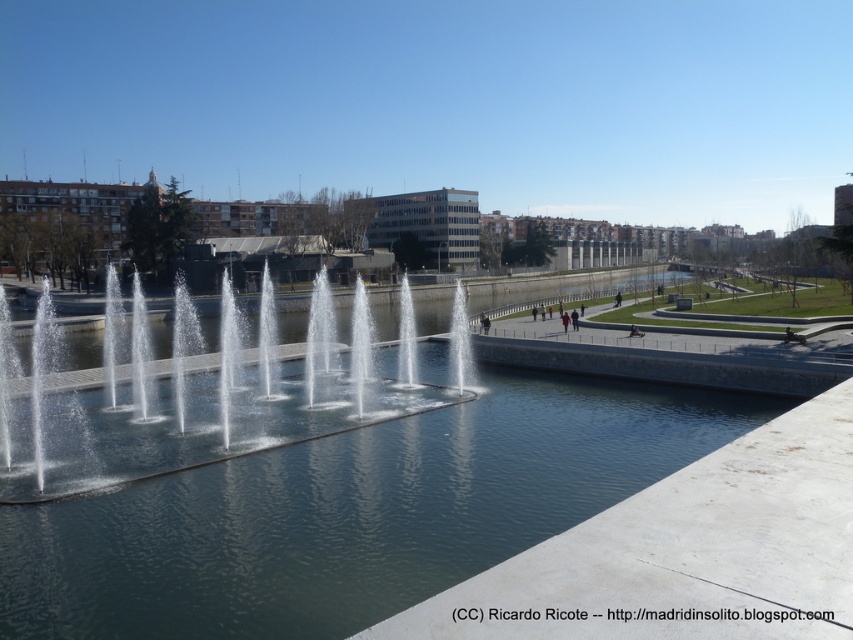
Question: Is clear water at center below clear water jets at center?

Choices:
 (A) no
 (B) yes

Answer: (B)

Question: Is clear water at center to the left of clear water jets at center from the viewer's perspective?

Choices:
 (A) yes
 (B) no

Answer: (B)

Question: Does clear water at center have a lesser width compared to clear water jets at center?

Choices:
 (A) yes
 (B) no

Answer: (B)

Question: Which of the following is the closest to the observer?

Choices:
 (A) (73, 560)
 (B) (56, 387)

Answer: (A)

Question: Which object is farther from the camera taking this photo?

Choices:
 (A) clear water at center
 (B) clear water jets at center

Answer: (B)